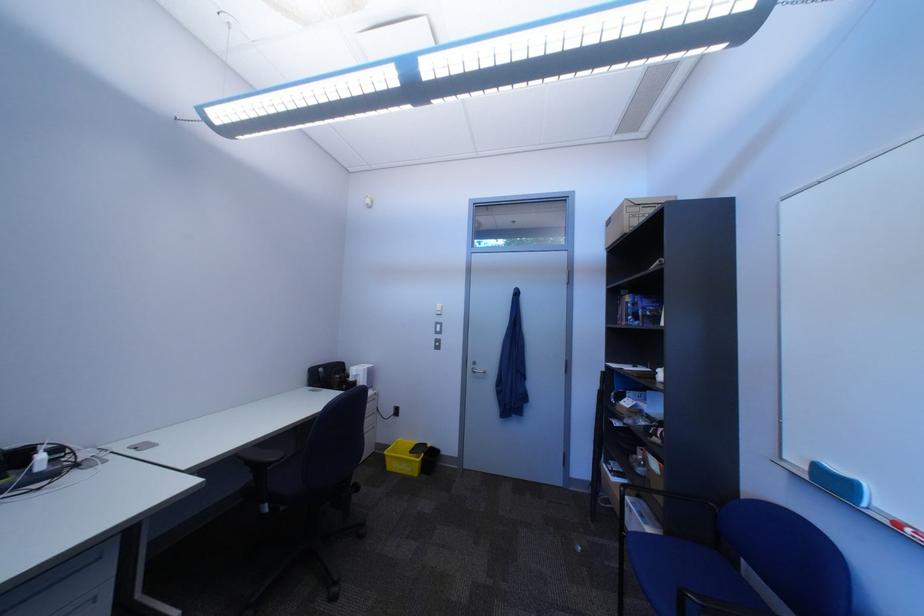
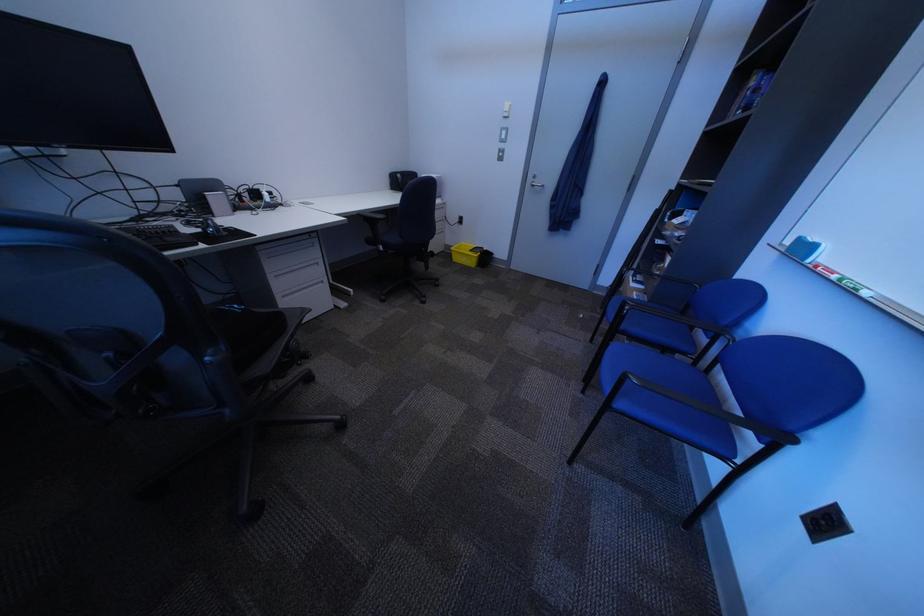
Where in the second image is the point corresponding to the point at 598,553 from the first image?

(599, 318)